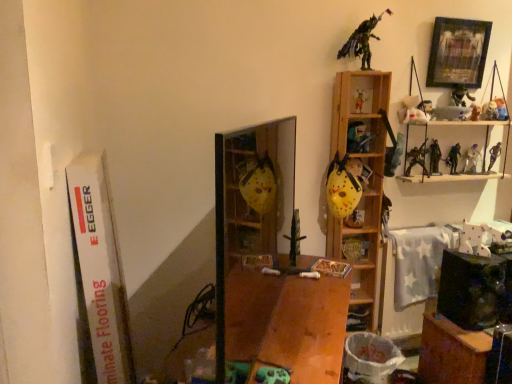
Find the location of a particular element. This screenshot has width=512, height=384. yellow matte mask at center, placed as the 14th toy when sorted from right to left is located at coordinates (343, 186).

Locate an element on the screen. The image size is (512, 384). wooden table at center is located at coordinates (287, 323).

How much space does metallic silver figure at upper right, the 7th toy in the left-to-right sequence, occupy horizontally?

It is 3.98 inches.

This screenshot has width=512, height=384. Describe the element at coordinates (360, 100) in the screenshot. I see `matte yellow mask at upper center, which appears as the fourth toy when viewed from the left` at that location.

This screenshot has width=512, height=384. Describe the element at coordinates (362, 173) in the screenshot. I see `yellow matte mask at center, acting as the first cabinet starting from the back` at that location.

In order to face yellow matte mask at center, acting as the third cabinet starting from the front, should I rotate leftwards or rightwards?

You should rotate right by 13.807 degrees.

Locate an element on the screen. yellow matte mask at center, positioned as the second toy in left-to-right order is located at coordinates (343, 186).

Is metallic green figure at upper right, marked as the thirteenth toy in a right-to-left arrangement, smaller than yellow matte mask at center, acting as the first cabinet starting from the back?

No.

Is metallic green figure at upper right, which appears as the 3th toy when viewed from the left, positioned far away from yellow matte mask at center, which is the second cabinet in right-to-left order?

No, metallic green figure at upper right, which appears as the 3th toy when viewed from the left, is not far away from yellow matte mask at center, which is the second cabinet in right-to-left order.

From a real-world perspective, who is located lower, metallic green figure at upper right, which appears as the 3th toy when viewed from the left, or yellow matte mask at center, which ranks as the second cabinet in left-to-right order?

yellow matte mask at center, which ranks as the second cabinet in left-to-right order, from a real-world perspective.

Relative to matte yellow mask at upper center, placed as the 11th toy when sorted from right to left, is white matte toy at upper right, the twelfth toy in the left-to-right sequence, in front or behind?

white matte toy at upper right, the twelfth toy in the left-to-right sequence, is behind matte yellow mask at upper center, placed as the 11th toy when sorted from right to left.

From a real-world perspective, is white matte toy at upper right, the twelfth toy in the left-to-right sequence, on matte yellow mask at upper center, placed as the 11th toy when sorted from right to left?

Yes, from a real-world perspective, white matte toy at upper right, the twelfth toy in the left-to-right sequence, is on top of matte yellow mask at upper center, placed as the 11th toy when sorted from right to left.

Can you tell me how much white matte toy at upper right, the twelfth toy in the left-to-right sequence, and matte yellow mask at upper center, placed as the 5th toy when sorted from left to right, differ in facing direction?

white matte toy at upper right, the twelfth toy in the left-to-right sequence, and matte yellow mask at upper center, placed as the 5th toy when sorted from left to right, are facing 5.08e-05 degrees away from each other.

Is white matte toy at upper right, the twelfth toy in the left-to-right sequence, to the right of matte yellow mask at upper center, placed as the 11th toy when sorted from right to left, from the viewer's perspective?

Yes.

Considering their positions, is wooden book at center located in front of or behind metallic green figure at upper right, which appears as the 3th toy when viewed from the left?

wooden book at center is in front of metallic green figure at upper right, which appears as the 3th toy when viewed from the left.

Based on their sizes in the image, would you say wooden book at center is bigger or smaller than metallic green figure at upper right, which appears as the 3th toy when viewed from the left?

In the image, wooden book at center appears to be smaller than metallic green figure at upper right, which appears as the 3th toy when viewed from the left.

Is wooden book at center aimed at metallic green figure at upper right, which appears as the 3th toy when viewed from the left?

No, wooden book at center is not aimed at metallic green figure at upper right, which appears as the 3th toy when viewed from the left.

From the image's perspective, between wooden book at center and metallic green figure at upper right, marked as the thirteenth toy in a right-to-left arrangement, which one is located above?

metallic green figure at upper right, marked as the thirteenth toy in a right-to-left arrangement.

From a real-world perspective, between matte yellow mask at upper center, placed as the 5th toy when sorted from left to right, and wooden book at center, who is vertically lower?

wooden book at center, from a real-world perspective.

Is matte yellow mask at upper center, placed as the 5th toy when sorted from left to right, turned away from wooden book at center?

No, matte yellow mask at upper center, placed as the 5th toy when sorted from left to right, is not facing the opposite direction of wooden book at center.

From the image's perspective, is matte yellow mask at upper center, placed as the 5th toy when sorted from left to right, above wooden book at center?

Indeed, from the image's perspective, matte yellow mask at upper center, placed as the 5th toy when sorted from left to right, is shown above wooden book at center.

Is white plush toy at upper right, the 6th toy viewed from the left, positioned far away from yellow matte mask at center, positioned as the second toy in left-to-right order?

white plush toy at upper right, the 6th toy viewed from the left, is actually quite close to yellow matte mask at center, positioned as the second toy in left-to-right order.

Can you tell me how much white plush toy at upper right, the 6th toy viewed from the left, and yellow matte mask at center, placed as the 14th toy when sorted from right to left, differ in facing direction?

The angular difference between white plush toy at upper right, the 6th toy viewed from the left, and yellow matte mask at center, placed as the 14th toy when sorted from right to left, is 24.2 degrees.

Between white plush toy at upper right, the 6th toy viewed from the left, and yellow matte mask at center, positioned as the second toy in left-to-right order, which one is positioned in front?

yellow matte mask at center, positioned as the second toy in left-to-right order, is more forward.

At what (x,y) coordinates should I click in order to perform the action: click on the 4th toy counting from the left of the white plush toy at upper right, the 6th toy viewed from the left. Please return your answer as a coordinate pair (x, y). This screenshot has height=384, width=512. Looking at the image, I should click on (343, 186).

From a real-world perspective, count 2nd toys downward from the matte plastic cabinet at center, marked as the second cabinet in a back-to-front arrangement, and point to it. Please provide its 2D coordinates.

[(453, 158)]

Could you tell me if green plastic toy at upper right, which is the 10th toy in left-to-right order, is facing matte plastic cabinet at center, placed as the first cabinet when sorted from right to left?

No, green plastic toy at upper right, which is the 10th toy in left-to-right order, is not turned towards matte plastic cabinet at center, placed as the first cabinet when sorted from right to left.

Based on the photo, is green plastic toy at upper right, which is the 10th toy in left-to-right order, placed right next to matte plastic cabinet at center, the second cabinet positioned from the front?

No, green plastic toy at upper right, which is the 10th toy in left-to-right order, is not making contact with matte plastic cabinet at center, the second cabinet positioned from the front.

Which object is closer to the camera, green plastic toy at upper right, which is the 10th toy in left-to-right order, or matte plastic cabinet at center, marked as the second cabinet in a back-to-front arrangement?

matte plastic cabinet at center, marked as the second cabinet in a back-to-front arrangement, is more forward.

Is yellow matte mask at center, positioned as the second toy in left-to-right order, to the right of metallic silver figure at upper right, the 2th toy from the right, from the viewer's perspective?

No, yellow matte mask at center, positioned as the second toy in left-to-right order, is not to the right of metallic silver figure at upper right, the 2th toy from the right.

Who is bigger, yellow matte mask at center, positioned as the second toy in left-to-right order, or metallic silver figure at upper right, the 2th toy from the right?

Bigger between the two is yellow matte mask at center, positioned as the second toy in left-to-right order.

This screenshot has height=384, width=512. In order to click on the 12th toy to the left of the metallic silver figure at upper right, the 2th toy from the right, counting from the anchor's position in this screenshot , I will do `click(343, 186)`.

Consider the image. Between yellow matte mask at center, positioned as the second toy in left-to-right order, and metallic silver figure at upper right, the 2th toy from the right, which one has less height?

metallic silver figure at upper right, the 2th toy from the right.

The height and width of the screenshot is (384, 512). Identify the location of toy that is the 3rd one when counting leftward from the yellow matte mask at center, which is the second cabinet in right-to-left order. (362, 41).

Where is `the 3rd toy located above the matte yellow mask at upper center, placed as the 11th toy when sorted from right to left (from a real-world perspective)`? This screenshot has width=512, height=384. the 3rd toy located above the matte yellow mask at upper center, placed as the 11th toy when sorted from right to left (from a real-world perspective) is located at coordinates (471, 160).

Considering their positions, is yellow matte mask at center, acting as the third cabinet starting from the front, positioned further to metallic silver toy at upper right, which is the fifth toy in right-to-left order, than wooden framed picture at upper right?

The object further to metallic silver toy at upper right, which is the fifth toy in right-to-left order, is yellow matte mask at center, acting as the third cabinet starting from the front.

Based on their spatial positions, is plush teddy bear at upper right, arranged as the first toy when viewed from the right, or white matte toy at upper right, acting as the 4th toy starting from the right, further from metallic silver toy at upper right, which is the fifth toy in right-to-left order?

white matte toy at upper right, acting as the 4th toy starting from the right.

Looking at the image, which one is located closer to wooden framed picture at upper right, wooden table at center or white plush toy at upper right, the 6th toy viewed from the left?

Among the two, white plush toy at upper right, the 6th toy viewed from the left, is located nearer to wooden framed picture at upper right.

From the image, which object appears to be nearer to metallic silver toy at upper right, the 11th toy from the left, matte plastic cabinet at center, placed as the first cabinet when sorted from right to left, or wooden book at center?

Based on the image, matte plastic cabinet at center, placed as the first cabinet when sorted from right to left, appears to be nearer to metallic silver toy at upper right, the 11th toy from the left.

Considering their positions, is matte yellow mask at upper center, placed as the 5th toy when sorted from left to right, positioned closer to yellow matte mask at center, acting as the first cabinet starting from the back, than transparent plastic cabinet at center, acting as the third cabinet starting from the back?

matte yellow mask at upper center, placed as the 5th toy when sorted from left to right, is closer to yellow matte mask at center, acting as the first cabinet starting from the back.

When comparing their distances from wooden shelf at upper right, does metallic silver toy at upper right, the 11th toy from the left, or matte yellow mask at upper center, placed as the 5th toy when sorted from left to right, seem closer?

Based on the image, matte yellow mask at upper center, placed as the 5th toy when sorted from left to right, appears to be nearer to wooden shelf at upper right.

Considering their positions, is white plush toy at upper right, which ranks as the 10th toy in right-to-left order, positioned closer to white matte toy at upper right, the twelfth toy in the left-to-right sequence, than metallic silver figure at upper right, which is the 14th toy from left to right?

Among the two, metallic silver figure at upper right, which is the 14th toy from left to right, is located nearer to white matte toy at upper right, the twelfth toy in the left-to-right sequence.

Which object lies further to the anchor point transparent plastic cabinet at center, the third cabinet positioned from the right, matte plastic toy soldier at upper right, which is the third toy in right-to-left order, or metallic silver figure at upper right, positioned as the seventh toy in right-to-left order?

matte plastic toy soldier at upper right, which is the third toy in right-to-left order.

Where is `table located between transparent plastic cabinet at center, acting as the third cabinet starting from the back, and metallic sword at center, acting as the first toy starting from the left, in the depth direction`? The width and height of the screenshot is (512, 384). table located between transparent plastic cabinet at center, acting as the third cabinet starting from the back, and metallic sword at center, acting as the first toy starting from the left, in the depth direction is located at coordinates (287, 323).

Where is `shelf between wooden framed picture at upper right and wooden book at center in the vertical direction`? shelf between wooden framed picture at upper right and wooden book at center in the vertical direction is located at coordinates 361,182.

This screenshot has width=512, height=384. Identify the location of book between wooden table at center and metallic sword at center, acting as the first toy starting from the left, in the front-back direction. (331, 267).

Where is `shelf between white plush toy at upper right, the 6th toy viewed from the left, and wooden book at center from top to bottom`? This screenshot has height=384, width=512. shelf between white plush toy at upper right, the 6th toy viewed from the left, and wooden book at center from top to bottom is located at coordinates (361, 182).